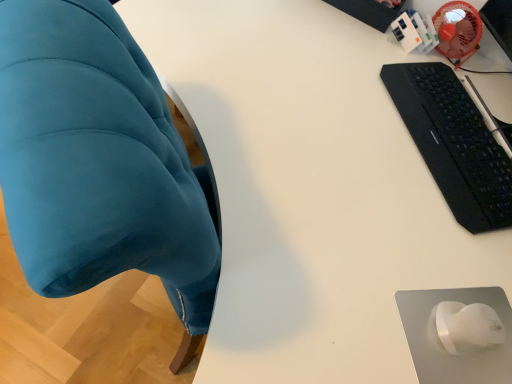
Find the location of a particular element. vacant space that is to the left of black matte keyboard at right is located at coordinates (330, 99).